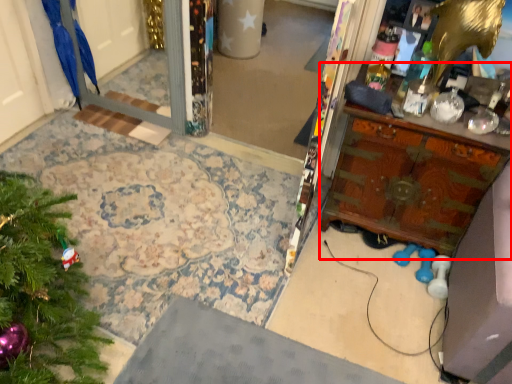
Question: In this image, where is vanity (annotated by the red box) located relative to parrot?

Choices:
 (A) left
 (B) right

Answer: (B)